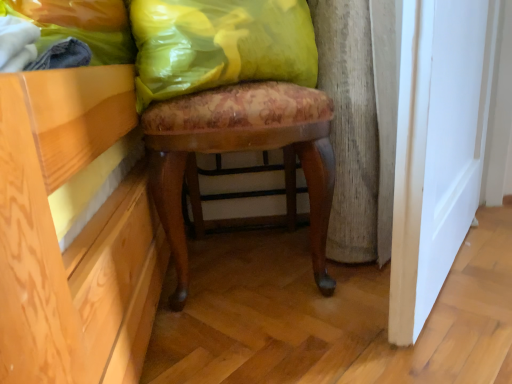
Image resolution: width=512 pixels, height=384 pixels. I want to click on vacant space in front of floral fabric stool at center, so click(294, 340).